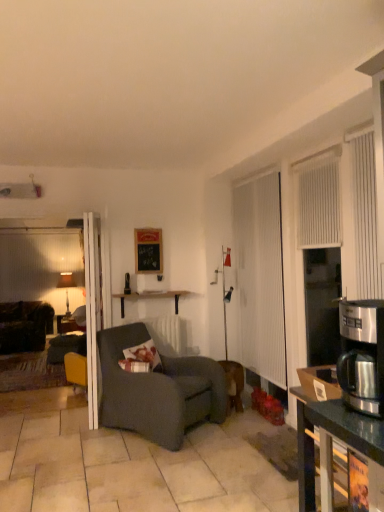
Image resolution: width=384 pixels, height=512 pixels. What do you see at coordinates (319, 200) in the screenshot?
I see `white vertical blinds at right` at bounding box center [319, 200].

Describe the element at coordinates (365, 214) in the screenshot. Image resolution: width=384 pixels, height=512 pixels. I see `white vertical blinds at right` at that location.

At what (x,y) coordinates should I click in order to perform the action: click on black matte picture frame at center. Please return your answer as a coordinate pair (x, y). This screenshot has height=512, width=384. Looking at the image, I should click on (148, 251).

Describe the element at coordinates (362, 355) in the screenshot. I see `stainless steel coffee maker at right` at that location.

Describe the element at coordinates (92, 313) in the screenshot. Image resolution: width=384 pixels, height=512 pixels. I see `white glossy door at center` at that location.

This screenshot has width=384, height=512. What are the coordinates of `textured gray pillow at center` in the screenshot? It's located at (145, 355).

What is the approximate width of textured gray pillow at center?

13.90 centimeters.

Where is `white vertical blinds at right`? white vertical blinds at right is located at coordinates (319, 200).

From the image's perspective, does black matte picture frame at center appear higher than stainless steel coffee maker at right?

Yes.

Between black matte picture frame at center and stainless steel coffee maker at right, which one has larger width?

stainless steel coffee maker at right.

Which of these two, black matte picture frame at center or stainless steel coffee maker at right, is bigger?

With larger size is stainless steel coffee maker at right.

How much distance is there between black matte picture frame at center and stainless steel coffee maker at right?

A distance of 10.45 feet exists between black matte picture frame at center and stainless steel coffee maker at right.

Is white vertical blinds at right inside black matte picture frame at center?

No, white vertical blinds at right is not inside black matte picture frame at center.

Which object is thinner, black matte picture frame at center or white vertical blinds at right?

black matte picture frame at center is thinner.

Looking at this image, is black matte picture frame at center far from white vertical blinds at right?

black matte picture frame at center is far away from white vertical blinds at right.

Is black matte picture frame at center turned away from white vertical blinds at right?

No, white vertical blinds at right is not at the back of black matte picture frame at center.

Is stainless steel coffee maker at right not close to white wood shelf at center?

That's right, there is a large distance between stainless steel coffee maker at right and white wood shelf at center.

From the image's perspective, which is below, stainless steel coffee maker at right or white wood shelf at center?

white wood shelf at center, from the image's perspective.

Identify the location of coffee maker that appears in front of the white wood shelf at center. (362, 355).

From the image's perspective, is white vertical blinds at right positioned above or below white wood shelf at center?

Based on their image positions, white vertical blinds at right is located above white wood shelf at center.

Is white vertical blinds at right turned away from white wood shelf at center?

That's not correct — white vertical blinds at right is not looking away from white wood shelf at center.

Considering the sizes of white vertical blinds at right and white wood shelf at center in the image, is white vertical blinds at right bigger or smaller than white wood shelf at center?

white vertical blinds at right is bigger than white wood shelf at center.

Does white vertical blinds at right appear on the right side of white wood shelf at center?

Yes, white vertical blinds at right is to the right of white wood shelf at center.

Considering the relative sizes of white vertical blinds at right and textured gray pillow at center in the image provided, is white vertical blinds at right shorter than textured gray pillow at center?

Incorrect, the height of white vertical blinds at right does not fall short of that of textured gray pillow at center.

Is white vertical blinds at right facing away from textured gray pillow at center?

That's not correct — white vertical blinds at right is not looking away from textured gray pillow at center.

Can you tell me how much white vertical blinds at right and textured gray pillow at center differ in facing direction?

The facing directions of white vertical blinds at right and textured gray pillow at center are 126 degrees apart.

From the image's perspective, does white vertical blinds at right appear lower than textured gray pillow at center?

Actually, white vertical blinds at right appears above textured gray pillow at center in the image.

From the image's perspective, which is below, matte black lampshade at left or stainless steel coffee maker at right?

matte black lampshade at left.

In the scene shown: Is matte black lampshade at left surrounding stainless steel coffee maker at right?

No, stainless steel coffee maker at right is located outside of matte black lampshade at left.

Between matte black lampshade at left and stainless steel coffee maker at right, which one has more height?

With more height is matte black lampshade at left.

From a real-world perspective, who is located lower, matte black lampshade at left or stainless steel coffee maker at right?

From a 3D spatial view, matte black lampshade at left is below.

I want to click on coffee maker located below the black matte picture frame at center (from the image's perspective), so click(362, 355).

Between stainless steel coffee maker at right and black matte picture frame at center, which one has more height?

Standing taller between the two is black matte picture frame at center.

From a real-world perspective, is stainless steel coffee maker at right physically below black matte picture frame at center?

Yes.

Is point (353, 301) behind point (154, 230)?

No, (353, 301) is closer to viewer.

The width and height of the screenshot is (384, 512). I want to click on picture frame behind the stainless steel coffee maker at right, so click(x=148, y=251).

Identify the location of window screen on the right side of black matte picture frame at center. The image size is (384, 512). (319, 200).

Which object lies nearer to the anchor point white vertical blinds at right, dark gray fabric chair at center or white wood shelf at center?

dark gray fabric chair at center is closer to white vertical blinds at right.

From the image, which object appears to be farther from white wood shelf at center, dark brown fabric couch at left or white vertical blinds at right?

The object further to white wood shelf at center is white vertical blinds at right.

Considering their positions, is matte black lampshade at left positioned further to dark gray fabric chair at center than black matte picture frame at center?

matte black lampshade at left is positioned further to the anchor dark gray fabric chair at center.

From the image, which object appears to be nearer to white textured screen door at right, matte black lampshade at left or dark brown fabric couch at left?

The object closer to white textured screen door at right is matte black lampshade at left.

Which object lies further to the anchor point stainless steel coffee maker at right, white wood shelf at center or white glossy door at center?

white wood shelf at center lies further to stainless steel coffee maker at right than the other object.

Considering their positions, is matte black lampshade at left positioned further to white wood shelf at center than white glossy door at center?

The object further to white wood shelf at center is matte black lampshade at left.

From the picture: Estimate the real-world distances between objects in this image. Which object is closer to stainless steel coffee maker at right, white glossy door at center or white vertical blinds at right?

Among the two, white vertical blinds at right is located nearer to stainless steel coffee maker at right.

Considering their positions, is stainless steel coffee maker at right positioned further to white textured screen door at right than white vertical blinds at right?

stainless steel coffee maker at right is further to white textured screen door at right.

The image size is (384, 512). Identify the location of screen door between dark gray fabric chair at center and matte black lampshade at left along the z-axis. (261, 276).

Locate an element on the screen. curtain between stainless steel coffee maker at right and white glossy door at center from front to back is located at coordinates (365, 214).

This screenshot has width=384, height=512. In order to click on pillow between black matte picture frame at center and white textured screen door at right in the horizontal direction in this screenshot , I will do `click(145, 355)`.

The width and height of the screenshot is (384, 512). I want to click on desk between white vertical blinds at right and dark brown fabric couch at left along the z-axis, so click(151, 297).